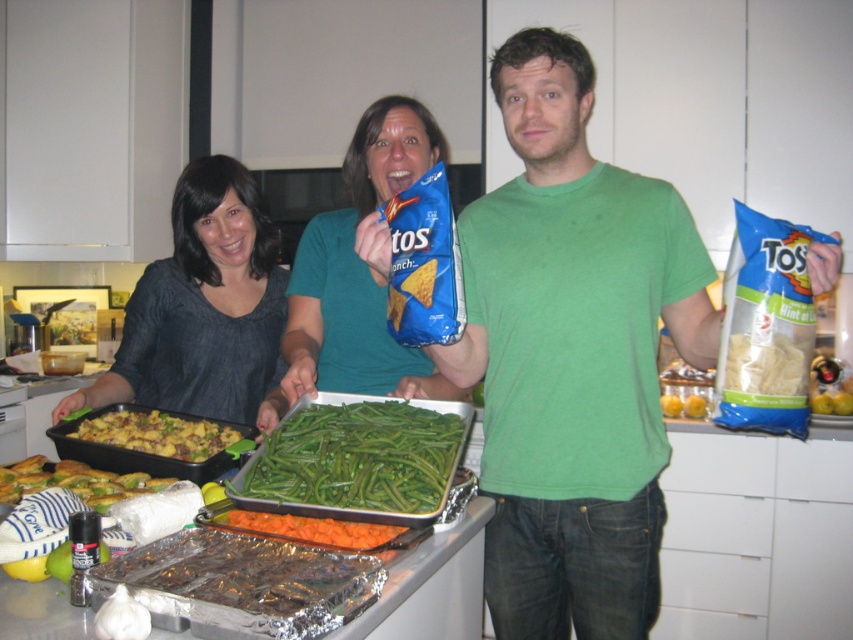
Question: Which point is closer to the camera taking this photo?

Choices:
 (A) (363, 310)
 (B) (86, 497)
 (C) (296, 410)

Answer: (B)

Question: Considering the relative positions of golden crispy chicken at center and matte brown chips at right in the image provided, where is golden crispy chicken at center located with respect to matte brown chips at right?

Choices:
 (A) left
 (B) right

Answer: (A)

Question: Which object appears closest to the camera in this image?

Choices:
 (A) matte brown chips at right
 (B) green smooth/texture green beans at center
 (C) orange glazed carrots at center
 (D) golden crispy chicken at center

Answer: (C)

Question: Can you confirm if matte brown chips at right is smaller than orange glazed carrots at center?

Choices:
 (A) no
 (B) yes

Answer: (B)

Question: Based on their relative distances, which object is nearer to the orange glazed carrots at center?

Choices:
 (A) green matte broccoli at lower left
 (B) green matte shirt at center
 (C) golden crispy chicken at center

Answer: (A)

Question: Is matte brown chips at right smaller than green matte broccoli at lower left?

Choices:
 (A) yes
 (B) no

Answer: (B)